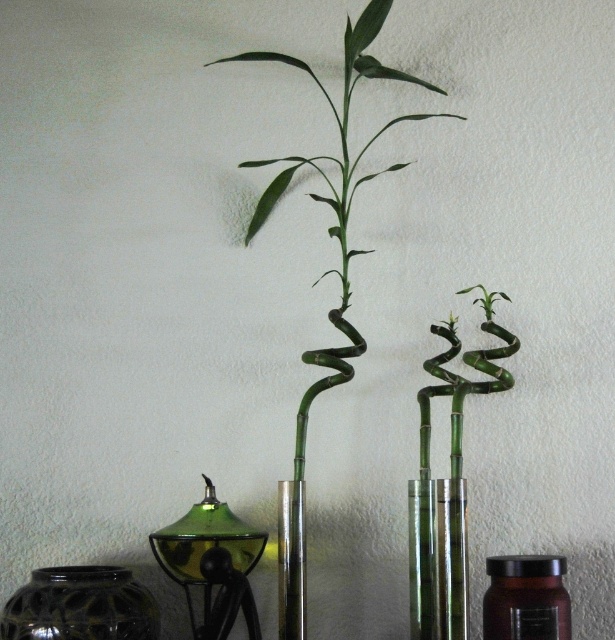
Question: Which point is farther to the camera?

Choices:
 (A) black glossy jar at lower left
 (B) green bamboo at center
 (C) translucent amber jar at center

Answer: (B)

Question: Is clear glass vase at center thinner than translucent amber jar at center?

Choices:
 (A) no
 (B) yes

Answer: (B)

Question: Which of these objects is positioned closest to the black glossy jar at lower left?

Choices:
 (A) translucent amber jar at center
 (B) clear glass vase at center

Answer: (B)

Question: From the image, what is the correct spatial relationship of green bamboo at center in relation to clear glass vase at center?

Choices:
 (A) right
 (B) left

Answer: (B)

Question: Is green bamboo at center above translucent amber jar at center?

Choices:
 (A) yes
 (B) no

Answer: (A)

Question: Which of the following is the farthest from the observer?

Choices:
 (A) (276, 179)
 (B) (456, 518)

Answer: (A)